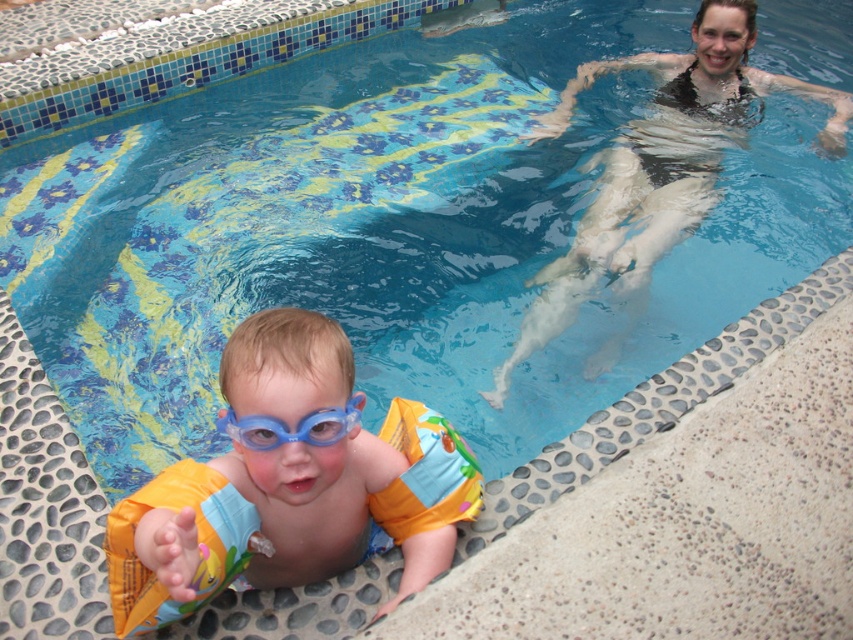
Question: Is blue rubber arm bands at lower left to the right of matte black swimsuit at upper right from the viewer's perspective?

Choices:
 (A) no
 (B) yes

Answer: (A)

Question: Is blue rubber arm bands at lower left wider than matte black swimsuit at upper right?

Choices:
 (A) yes
 (B) no

Answer: (B)

Question: Can you confirm if blue rubber arm bands at lower left is wider than matte black swimsuit at upper right?

Choices:
 (A) no
 (B) yes

Answer: (A)

Question: Which is nearer to the blue rubber goggles at lower center?

Choices:
 (A) matte black swimsuit at upper right
 (B) blue rubber arm bands at lower left

Answer: (B)

Question: Among these objects, which one is nearest to the camera?

Choices:
 (A) matte black swimsuit at upper right
 (B) blue rubber arm bands at lower left

Answer: (B)

Question: Among these points, which one is nearest to the camera?

Choices:
 (A) (671, 216)
 (B) (416, 448)

Answer: (B)